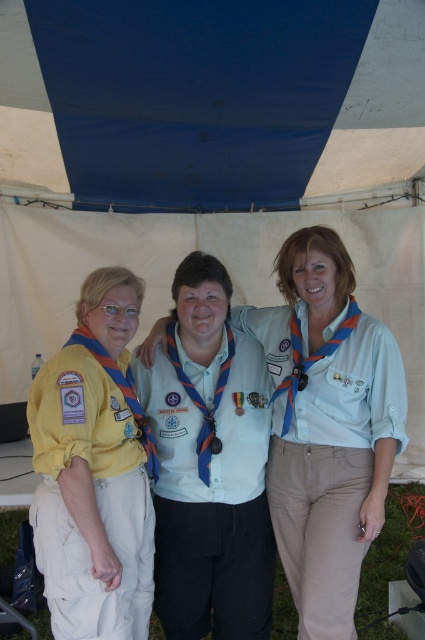
Is blue fabric uniform at center bigger than light blue cotton shirt at center?

No.

Is point (223, 604) in front of point (320, 563)?

That is False.

This screenshot has height=640, width=425. In order to click on blue fabric uniform at center in this screenshot , I will do `click(210, 493)`.

In the scene shown: Who is lower down, blue fabric uniform at center or yellow fabric uniform at left?

blue fabric uniform at center is below.

Does blue fabric uniform at center appear on the left side of yellow fabric uniform at left?

In fact, blue fabric uniform at center is to the right of yellow fabric uniform at left.

This screenshot has height=640, width=425. In order to click on blue fabric uniform at center in this screenshot , I will do `click(210, 493)`.

This screenshot has width=425, height=640. Identify the location of blue fabric uniform at center. (210, 493).

Does light blue cotton shirt at center appear on the left side of yellow fabric uniform at left?

No, light blue cotton shirt at center is not to the left of yellow fabric uniform at left.

Is light blue cotton shirt at center positioned behind yellow fabric uniform at left?

Yes, light blue cotton shirt at center is further from the viewer.

The image size is (425, 640). Find the location of `light blue cotton shirt at center`. light blue cotton shirt at center is located at coordinates (333, 472).